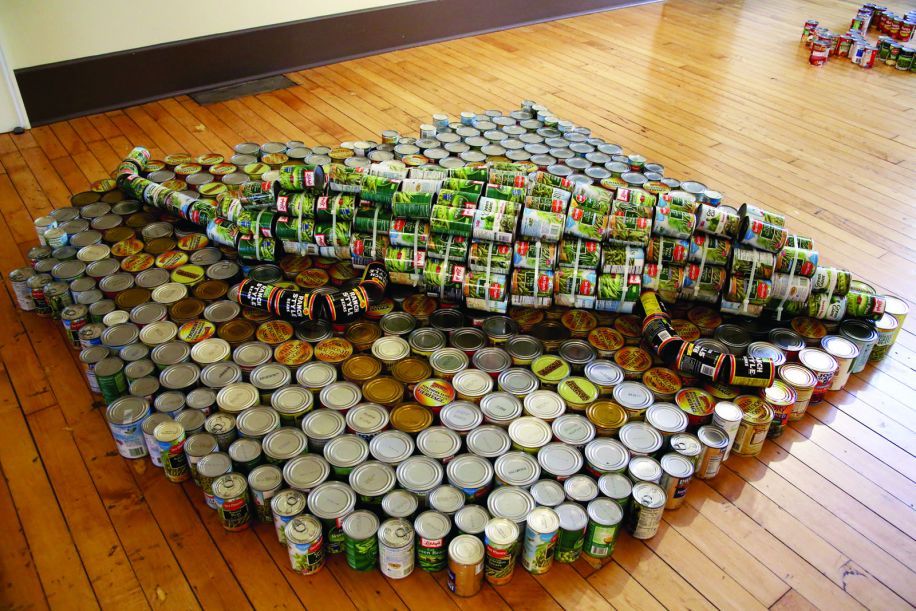
Locate an element on the screen. This screenshot has height=611, width=916. floor is located at coordinates (587, 60).